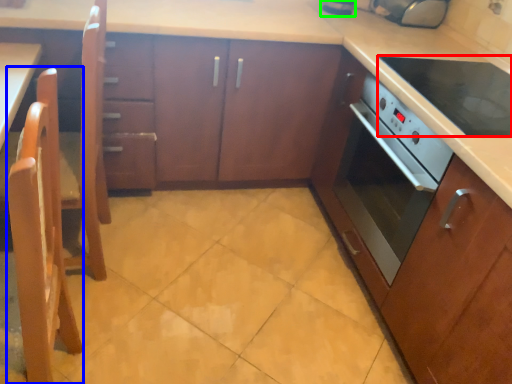
Question: Based on their relative distances, which object is nearer to kitchen appliance (highlighted by a red box)? Choose from chair (highlighted by a blue box) and appliance (highlighted by a green box).

Choices:
 (A) chair
 (B) appliance

Answer: (B)